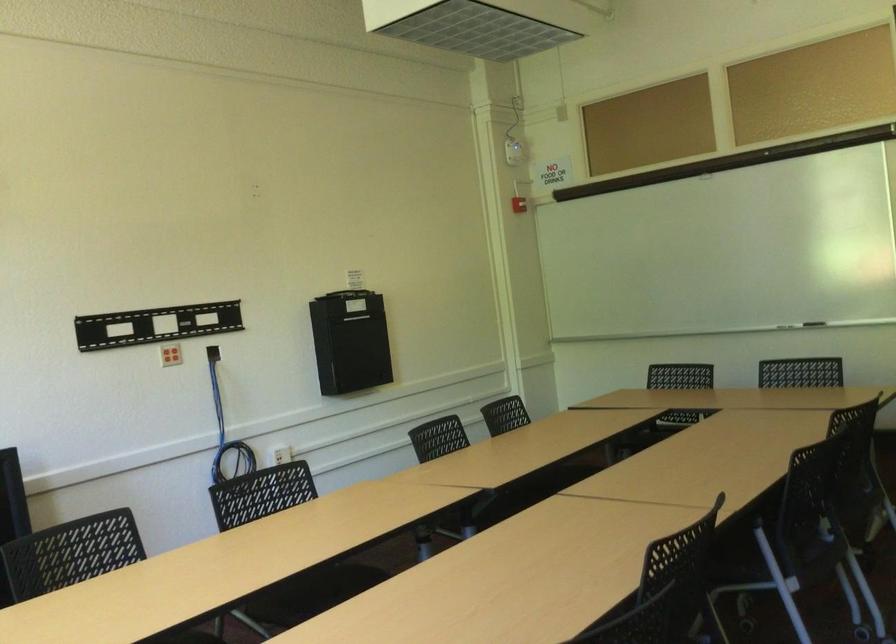
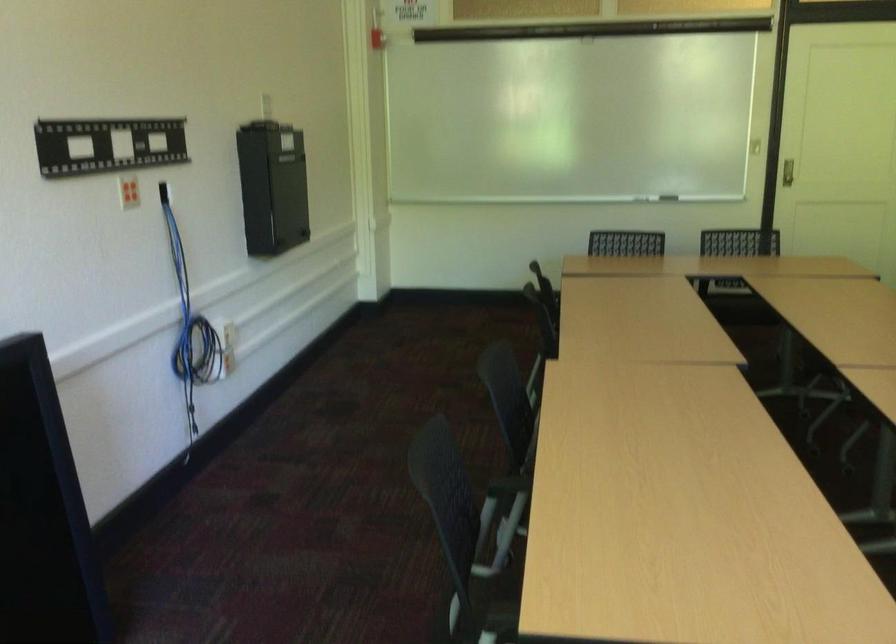
In the second image, find the point that corresponds to point (795, 337) in the first image.

(668, 198)